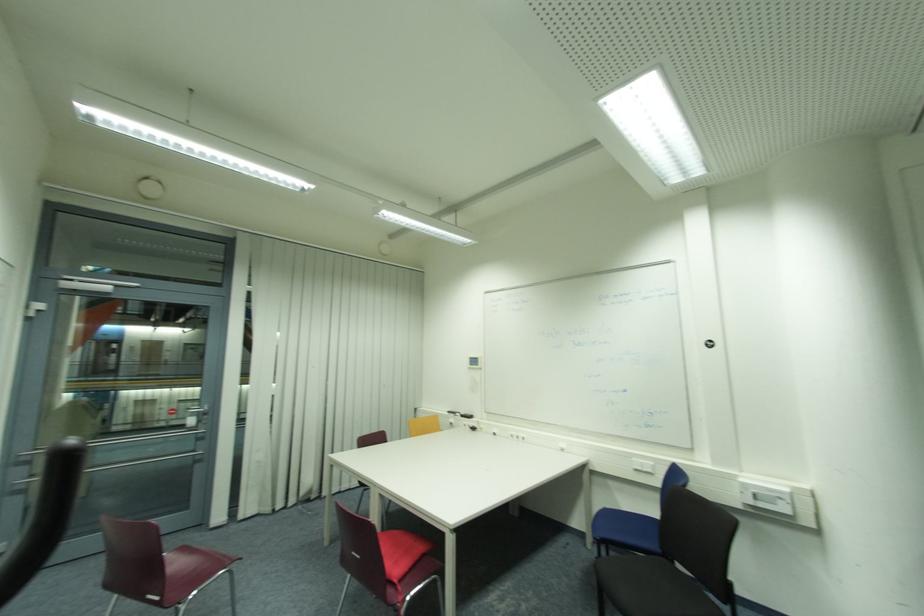
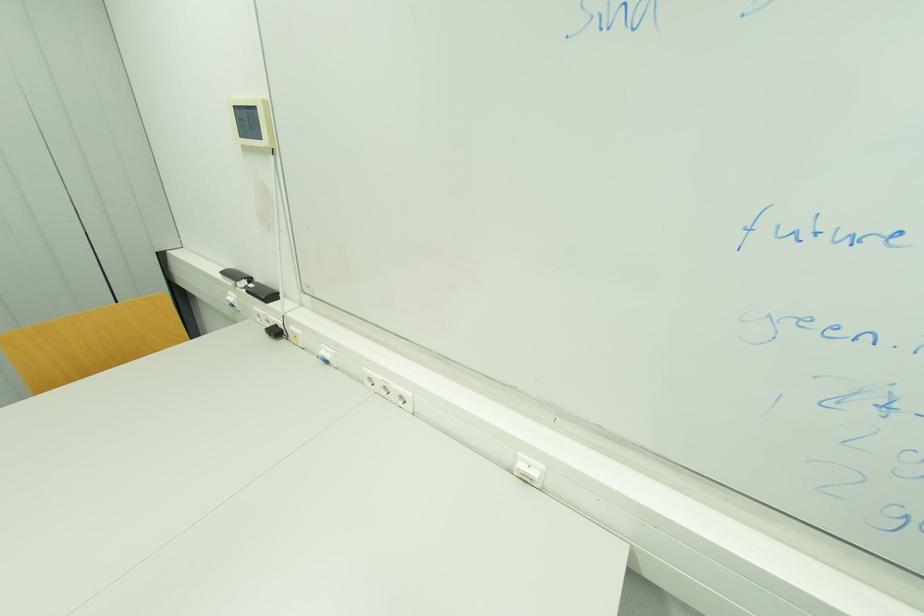
The point at (478, 430) is marked in the first image. Where is the corresponding point in the second image?

(281, 333)